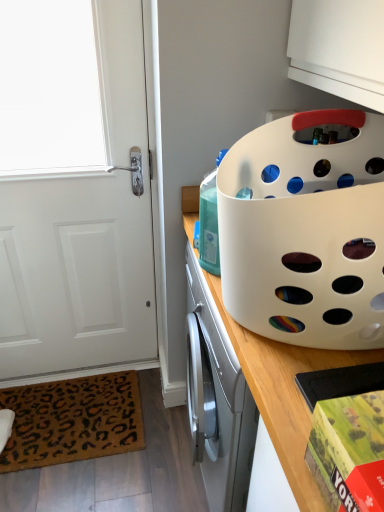
Describe the element at coordinates (209, 222) in the screenshot. I see `translucent plastic bottle at center` at that location.

Locate an element on the screen. red matte board game box at lower right is located at coordinates (349, 451).

This screenshot has width=384, height=512. What do you see at coordinates (74, 189) in the screenshot? I see `white matte door at left` at bounding box center [74, 189].

Where is `white matte door at left`? This screenshot has height=512, width=384. white matte door at left is located at coordinates (74, 189).

Identify the location of brown leopard print mat at lower left. This screenshot has width=384, height=512. (72, 420).

From the image's perspective, is brown leopard print mat at lower left located above or below white plastic basket at upper right?

From the image's perspective, brown leopard print mat at lower left appears below white plastic basket at upper right.

From the picture: What's the angular difference between brown leopard print mat at lower left and white plastic basket at upper right's facing directions?

90.1 degrees.

In the scene shown: Is white plastic basket at upper right at the back of brown leopard print mat at lower left?

That's not correct — brown leopard print mat at lower left is not looking away from white plastic basket at upper right.

Looking at this image, is brown leopard print mat at lower left directly adjacent to white plastic basket at upper right?

No, brown leopard print mat at lower left is not touching white plastic basket at upper right.

How much distance is there between brown leopard print mat at lower left and white plastic basket at upper right?

1.18 meters.

In order to click on basket above the brown leopard print mat at lower left (from a real-world perspective) in this screenshot , I will do `click(306, 230)`.

In the scene shown: Visually, is brown leopard print mat at lower left positioned to the left or to the right of white plastic basket at upper right?

brown leopard print mat at lower left is positioned on white plastic basket at upper right's left side.

In the image, is brown leopard print mat at lower left positioned in front of or behind white plastic basket at upper right?

Clearly, brown leopard print mat at lower left is behind white plastic basket at upper right.

From a real-world perspective, is white matte door at left physically located above or below white plastic basket at upper right?

From a real-world perspective, white matte door at left is physically above white plastic basket at upper right.

Can white plastic basket at upper right be found inside white matte door at left?

Actually, white plastic basket at upper right is outside white matte door at left.

Can you confirm if white matte door at left is smaller than white plastic basket at upper right?

Yes, white matte door at left is smaller than white plastic basket at upper right.

From the image's perspective, which is below, white matte door at left or white plastic basket at upper right?

white plastic basket at upper right appears lower in the image.

Is the position of red matte board game box at lower right more distant than that of translucent plastic bottle at center?

No, the depth of red matte board game box at lower right is less than that of translucent plastic bottle at center.

Consider the image. Is translucent plastic bottle at center surrounded by red matte board game box at lower right?

No.

How much distance is there between red matte board game box at lower right and translucent plastic bottle at center?

They are 19.66 inches apart.

Considering the relative sizes of white matte door at left and brown leopard print mat at lower left in the image provided, is white matte door at left smaller than brown leopard print mat at lower left?

No.

Considering the relative positions of white matte door at left and brown leopard print mat at lower left in the image provided, is white matte door at left to the left of brown leopard print mat at lower left from the viewer's perspective?

No.

From the image's perspective, is white matte door at left below brown leopard print mat at lower left?

No, from the image's perspective, white matte door at left is not beneath brown leopard print mat at lower left.

Is red matte board game box at lower right positioned before white plastic basket at upper right?

Yes, the depth of red matte board game box at lower right is less than that of white plastic basket at upper right.

Is white plastic basket at upper right at the back of red matte board game box at lower right?

That's not correct — red matte board game box at lower right is not looking away from white plastic basket at upper right.

In terms of width, does red matte board game box at lower right look wider or thinner when compared to white plastic basket at upper right?

Clearly, red matte board game box at lower right has less width compared to white plastic basket at upper right.

Considering the relative sizes of white plastic basket at upper right and red matte board game box at lower right in the image provided, is white plastic basket at upper right bigger than red matte board game box at lower right?

Correct, white plastic basket at upper right is larger in size than red matte board game box at lower right.

Is white plastic basket at upper right facing away from red matte board game box at lower right?

No, white plastic basket at upper right is not facing the opposite direction of red matte board game box at lower right.

Consider the image. Which object is positioned more to the left, white plastic basket at upper right or red matte board game box at lower right?

Positioned to the left is red matte board game box at lower right.

The width and height of the screenshot is (384, 512). In order to click on countertop above the brown leopard print mat at lower left (from a real-world perspective) in this screenshot , I will do `click(284, 393)`.

You are a GUI agent. You are given a task and a screenshot of the screen. Output one action in this format:
    pyautogui.click(x=<x>, y=<y>)
    Task: Click on the basket in front of the brown leopard print mat at lower left
    This screenshot has height=512, width=384.
    Given the screenshot: What is the action you would take?
    pyautogui.click(x=306, y=230)

When comparing their distances from red matte board game box at lower right, does translucent plastic bottle at center or white matte door at left seem closer?

The object closer to red matte board game box at lower right is translucent plastic bottle at center.

Which object lies further to the anchor point white plastic basket at upper right, translucent plastic bottle at center or white plastic basket at upper right?

translucent plastic bottle at center is further to white plastic basket at upper right.

Looking at the image, which one is located closer to brown leopard print mat at lower left, white plastic basket at upper right or white matte door at left?

white matte door at left is closer to brown leopard print mat at lower left.

In the scene shown: Estimate the real-world distances between objects in this image. Which object is further from white plastic basket at upper right, white matte door at left or red matte board game box at lower right?

white matte door at left.

From the image, which object appears to be nearer to white plastic basket at upper right, white plastic basket at upper right or white matte door at left?

white plastic basket at upper right lies closer to white plastic basket at upper right than the other object.

Considering their positions, is red matte board game box at lower right positioned closer to translucent plastic bottle at center than brown leopard print mat at lower left?

red matte board game box at lower right.

From the image, which object appears to be farther from white matte door at left, red matte board game box at lower right or translucent plastic bottle at center?

Based on the image, red matte board game box at lower right appears to be further to white matte door at left.

Which object lies further to the anchor point red matte board game box at lower right, translucent plastic bottle at center or white plastic basket at upper right?

translucent plastic bottle at center lies further to red matte board game box at lower right than the other object.

At what (x,y) coordinates should I click in order to perform the action: click on box between white matte door at left and white plastic basket at upper right from left to right. Please return your answer as a coordinate pair (x, y). Looking at the image, I should click on (349, 451).

This screenshot has height=512, width=384. What are the coordinates of `bottle between white matte door at left and white plastic basket at upper right from left to right` in the screenshot? It's located at (209, 222).

I want to click on bottle between white matte door at left and red matte board game box at lower right from left to right, so tap(209, 222).

At what (x,y) coordinates should I click in order to perform the action: click on basket between translucent plastic bottle at center and white plastic basket at upper right vertically. Please return your answer as a coordinate pair (x, y). Looking at the image, I should click on (306, 230).